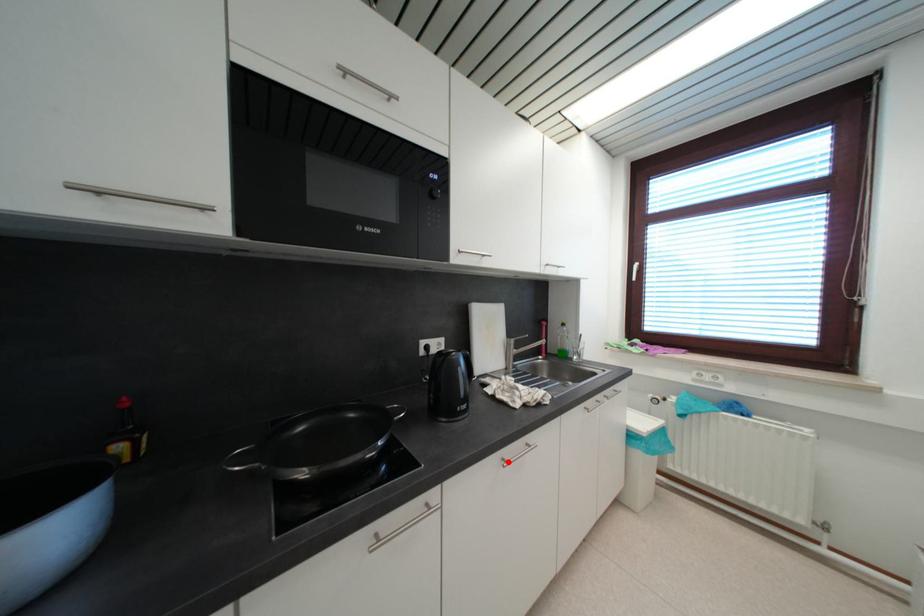
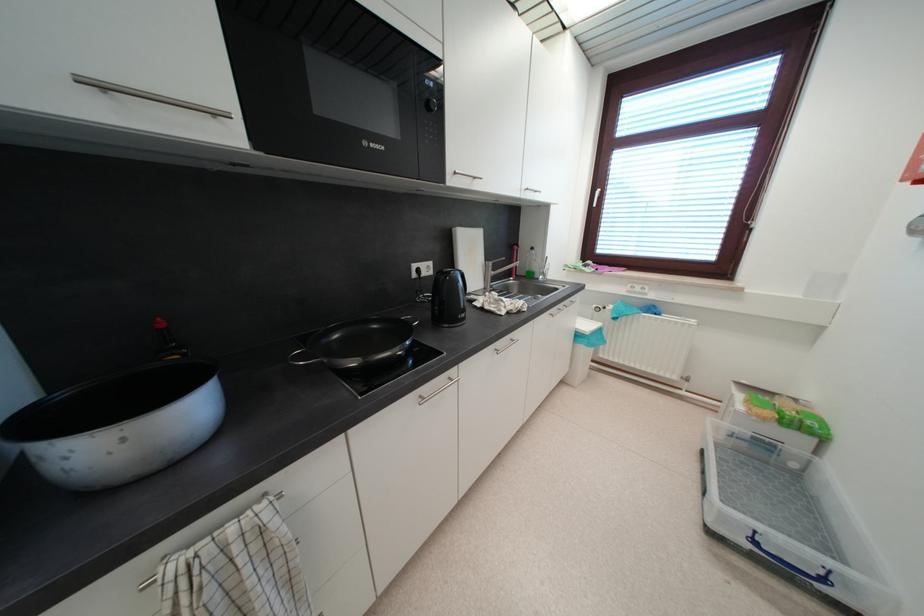
Find the pixel in the second image that matches the highlighted location in the first image.

(502, 352)